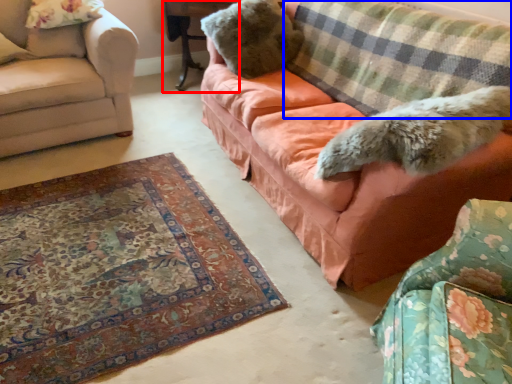
Question: Which point is further to the camera, table (highlighted by a red box) or plaid (highlighted by a blue box)?

Choices:
 (A) table
 (B) plaid

Answer: (A)